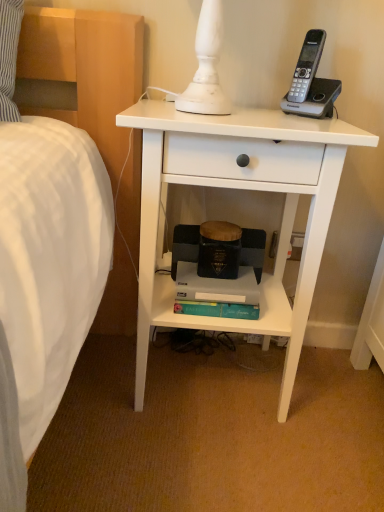
Find the location of a particular element. The image size is (384, 512). teal matte paperback book at lower center is located at coordinates 217,286.

Describe the element at coordinates (217, 286) in the screenshot. This screenshot has width=384, height=512. I see `teal matte paperback book at lower center` at that location.

In order to face white matte nightstand at center, should I rotate leftwards or rightwards?

Rotate right and turn 3.895 degrees.

Where is `white matte nightstand at center`? This screenshot has height=512, width=384. white matte nightstand at center is located at coordinates (239, 189).

Describe the element at coordinates (239, 189) in the screenshot. I see `white matte nightstand at center` at that location.

Where is `teal matte paperback book at lower center`? Image resolution: width=384 pixels, height=512 pixels. teal matte paperback book at lower center is located at coordinates 217,286.

Does white matte nightstand at center appear on the left side of teal matte paperback book at lower center?

Incorrect, white matte nightstand at center is not on the left side of teal matte paperback book at lower center.

Relative to teal matte paperback book at lower center, is white matte nightstand at center in front or behind?

Visually, white matte nightstand at center is located in front of teal matte paperback book at lower center.

Which is behind, point (129, 122) or point (258, 293)?

Positioned behind is point (258, 293).

From the image's perspective, is white matte nightstand at center beneath teal matte paperback book at lower center?

Incorrect, from the image's perspective, white matte nightstand at center is higher than teal matte paperback book at lower center.

From a real-world perspective, is white matte nightstand at center positioned above or below teal matte paperback book at lower center?

In terms of real-world spatial position, white matte nightstand at center is above teal matte paperback book at lower center.

In terms of width, does white matte nightstand at center look wider or thinner when compared to teal matte paperback book at lower center?

In the image, white matte nightstand at center appears to be wider than teal matte paperback book at lower center.

Considering the relative sizes of white matte nightstand at center and teal matte paperback book at lower center in the image provided, is white matte nightstand at center shorter than teal matte paperback book at lower center?

No, white matte nightstand at center is not shorter than teal matte paperback book at lower center.

Considering the sizes of objects white matte nightstand at center and teal matte paperback book at lower center in the image provided, who is smaller, white matte nightstand at center or teal matte paperback book at lower center?

With smaller size is teal matte paperback book at lower center.

Is white matte nightstand at center inside or outside of teal matte paperback book at lower center?

white matte nightstand at center lies outside teal matte paperback book at lower center.

From the picture: Is white matte nightstand at center far from teal matte paperback book at lower center?

That's not correct — white matte nightstand at center is a little close to teal matte paperback book at lower center.

Is white matte nightstand at center facing away from teal matte paperback book at lower center?

Yes, teal matte paperback book at lower center is at the back of white matte nightstand at center.

Identify the location of nightstand in front of the teal matte paperback book at lower center. coord(239,189).

Is teal matte paperback book at lower center to the left or to the right of white matte nightstand at center in the image?

teal matte paperback book at lower center is to the left of white matte nightstand at center.

Is teal matte paperback book at lower center closer to camera compared to white matte nightstand at center?

No, teal matte paperback book at lower center is further to the viewer.

Considering the points (236, 297) and (134, 106), which point is in front, point (236, 297) or point (134, 106)?

Positioned in front is point (134, 106).

From the image's perspective, which one is positioned higher, teal matte paperback book at lower center or white matte nightstand at center?

white matte nightstand at center appears higher in the image.

From a real-world perspective, which object rests below the other?

In real-world perspective, teal matte paperback book at lower center is lower.

Between teal matte paperback book at lower center and white matte nightstand at center, which one has smaller width?

Thinner between the two is teal matte paperback book at lower center.

Which of these two, teal matte paperback book at lower center or white matte nightstand at center, stands taller?

Standing taller between the two is white matte nightstand at center.

Between teal matte paperback book at lower center and white matte nightstand at center, which one has larger size?

Bigger between the two is white matte nightstand at center.

Choose the correct answer: Is teal matte paperback book at lower center inside white matte nightstand at center or outside it?

teal matte paperback book at lower center lies within the bounds of white matte nightstand at center.

Are teal matte paperback book at lower center and white matte nightstand at center far apart?

No.

Is teal matte paperback book at lower center positioned with its back to white matte nightstand at center?

Yes, white matte nightstand at center is at the back of teal matte paperback book at lower center.

Locate an element on the screen. The height and width of the screenshot is (512, 384). nightstand above the teal matte paperback book at lower center (from the image's perspective) is located at coordinates (239, 189).

Locate an element on the screen. paperback book behind the white matte nightstand at center is located at coordinates (217, 286).

At what (x,y) coordinates should I click in order to perform the action: click on paperback book lying on the left of white matte nightstand at center. Please return your answer as a coordinate pair (x, y). Looking at the image, I should click on (217, 286).